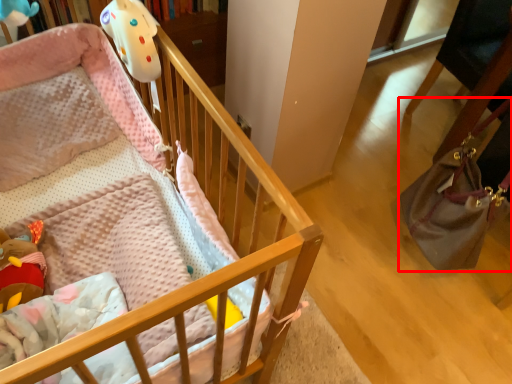
Question: In this image, where is handbag (annotated by the red box) located relative to infant bed?

Choices:
 (A) right
 (B) left

Answer: (A)